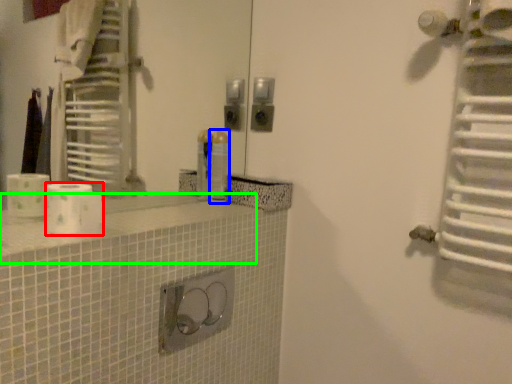
Question: Based on their relative distances, which object is nearer to toilet paper (highlighted by a red box)? Choose from toiletry (highlighted by a blue box) and counter top (highlighted by a green box).

Choices:
 (A) toiletry
 (B) counter top

Answer: (B)